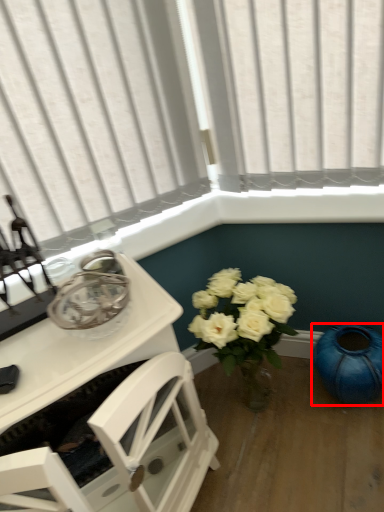
Question: Observing the image, what is the correct spatial positioning of teal (annotated by the red box) in reference to table?

Choices:
 (A) right
 (B) left

Answer: (A)